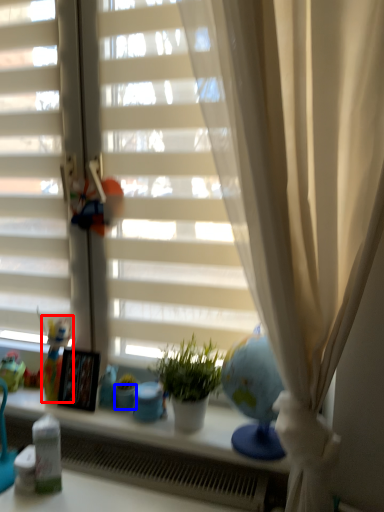
Question: Which of the following is the closest to the observer, doll (highlighted by a red box) or glass vase (highlighted by a blue box)?

Choices:
 (A) doll
 (B) glass vase

Answer: (B)